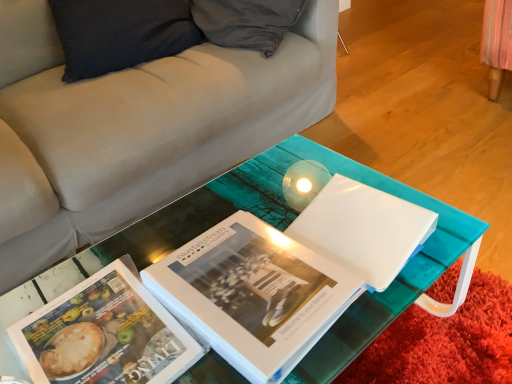
Question: Considering the positions of matte paper book at center, which is counted as the 2th book, starting from the right, and white glossy folder at center in the image, is matte paper book at center, which is counted as the 2th book, starting from the right, bigger or smaller than white glossy folder at center?

Choices:
 (A) big
 (B) small

Answer: (B)

Question: Is matte paper book at center, which is counted as the 2th book, starting from the right, taller or shorter than white glossy folder at center?

Choices:
 (A) short
 (B) tall

Answer: (A)

Question: Estimate the real-world distances between objects in this image. Which object is closer to the matte paper book at center, which is the 1th book from left to right?

Choices:
 (A) white glossy folder at center
 (B) transparent glass table at center
 (C) white glossy book at center, arranged as the 2th book when viewed from the left

Answer: (C)

Question: Which is farther from the matte paper book at center, which is the 1th book from left to right?

Choices:
 (A) white glossy folder at center
 (B) transparent glass table at center
 (C) white glossy book at center, arranged as the 1th book when viewed from the right

Answer: (A)